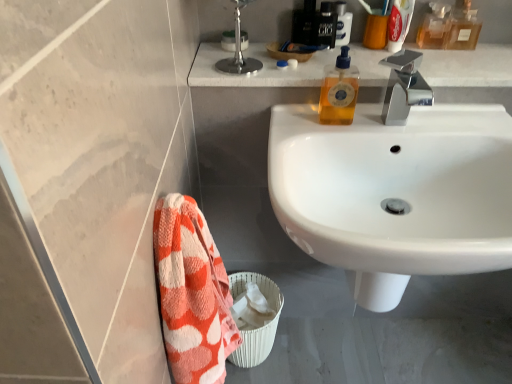
Locate an element on the screen. This screenshot has width=512, height=384. vacant space to the left of transparent glass bottle at upper right, acting as the fourth mouthwash starting from the left is located at coordinates (410, 53).